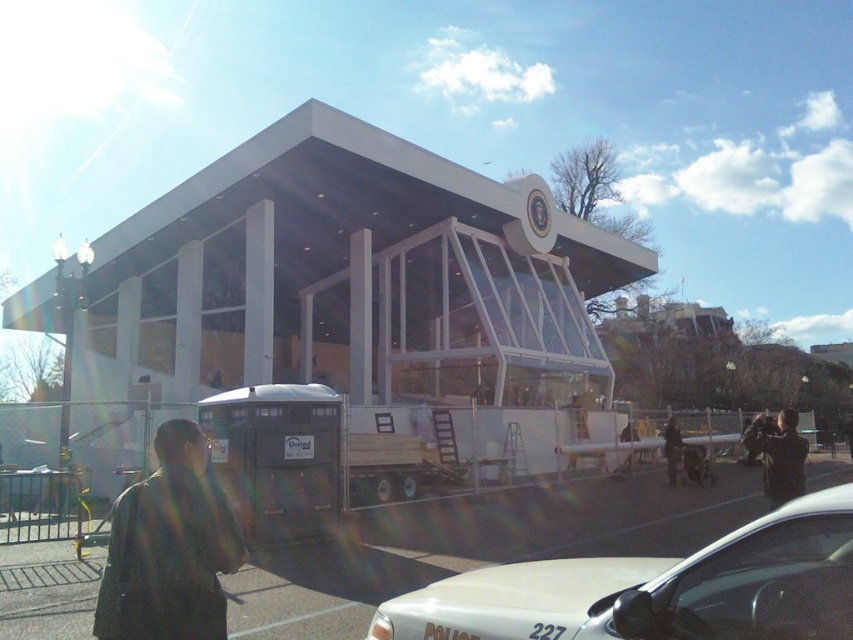
Does black leather jacket at lower right have a greater width compared to dark brown leather jacket at lower right?

Yes.

Who is shorter, black leather jacket at lower right or dark brown leather jacket at lower right?

Standing shorter between the two is dark brown leather jacket at lower right.

Between point (793, 428) and point (669, 480), which one is positioned behind?

The point (669, 480) is more distant.

This screenshot has height=640, width=853. What are the coordinates of `black leather jacket at lower right` in the screenshot? It's located at (778, 456).

Which is more to the left, dark brown leather jacket at lower left or black leather jacket at lower right?

dark brown leather jacket at lower left

Does dark brown leather jacket at lower left have a greater width compared to black leather jacket at lower right?

No.

This screenshot has width=853, height=640. What are the coordinates of `dark brown leather jacket at lower left` in the screenshot? It's located at (169, 547).

Who is more distant from viewer, [784,516] or [668,417]?

Positioned behind is point [668,417].

In the scene shown: Measure the distance from white glossy police car at lower center to dark brown leather jacket at lower right.

white glossy police car at lower center is 16.44 meters away from dark brown leather jacket at lower right.

Where is `white glossy police car at lower center`? This screenshot has height=640, width=853. white glossy police car at lower center is located at coordinates (657, 588).

Identify the location of white glossy police car at lower center. The width and height of the screenshot is (853, 640). (657, 588).